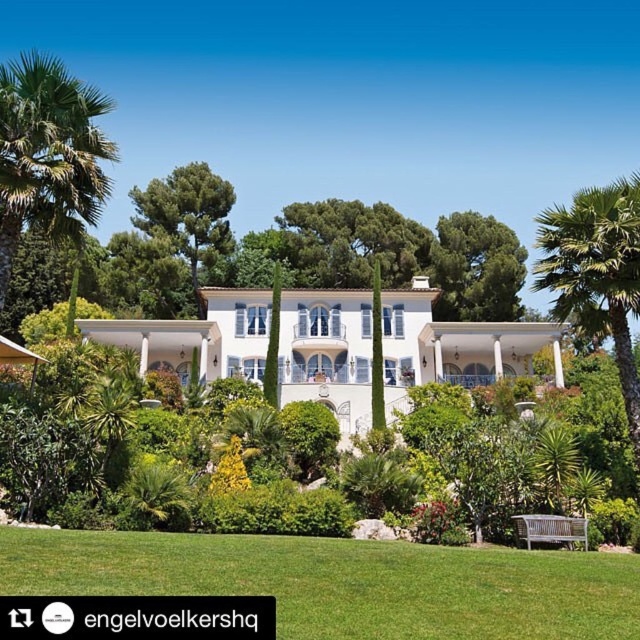
You are standing at the center of the villa courtyard. You see a green leafy palm tree at left located at point (48, 156). Is there any object at that point?

Yes, there is a green leafy palm tree at left located at point (48, 156).

You are a landscape architect planning to plant a new tree in the villa garden. The white glossy mansion at center is currently below the green leafy tree at upper center. If you want to ensure the mansion remains visible from the garden entrance, which tree should you avoid planting closer to the mansion?

You should avoid planting the green leafy tree at upper center closer to the mansion because the mansion is already located below it, and moving the tree closer would block the view from the garden entrance.

In the scene shown: In the image of the luxurious villa surrounded by greenery, how does the size of the white glossy mansion at center compare to the green leafy tree at upper center?

The white glossy mansion at center is bigger than the green leafy tree at upper center.